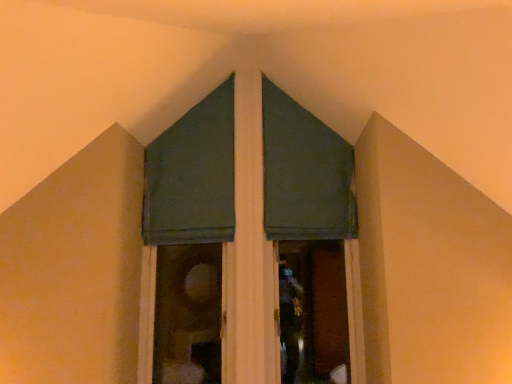
Find the location of a particular element. The width and height of the screenshot is (512, 384). green fabric curtain at center, which ranks as the 2th curtain in left-to-right order is located at coordinates pos(192,176).

Identify the location of green fabric curtain at upper center, the 3th curtain in the right-to-left sequence. The height and width of the screenshot is (384, 512). (192, 176).

From the picture: Considering the positions of objects green fabric curtain at center, which ranks as the 2th curtain in left-to-right order, and green fabric curtain at upper center, the 3th curtain in the right-to-left sequence, in the image provided, who is more to the right, green fabric curtain at center, which ranks as the 2th curtain in left-to-right order, or green fabric curtain at upper center, the 3th curtain in the right-to-left sequence,?

green fabric curtain at center, which ranks as the 2th curtain in left-to-right order.

Is green fabric curtain at upper center, marked as the 1th curtain in a left-to-right arrangement, completely or partially inside green fabric curtain at center, which ranks as the 2th curtain in left-to-right order?

Yes, green fabric curtain at upper center, marked as the 1th curtain in a left-to-right arrangement, can be found within green fabric curtain at center, which ranks as the 2th curtain in left-to-right order.

From a real-world perspective, which is physically above, green fabric curtain at center, placed as the second curtain when sorted from right to left, or green fabric curtain at upper center, the 3th curtain in the right-to-left sequence?

In real-world perspective, green fabric curtain at upper center, the 3th curtain in the right-to-left sequence, is above.

Looking at this image, which object is closer to the camera, green fabric curtain at center, which ranks as the 2th curtain in left-to-right order, or green fabric curtain at upper center, marked as the 1th curtain in a left-to-right arrangement?

Positioned in front is green fabric curtain at center, which ranks as the 2th curtain in left-to-right order.

From their relative heights in the image, would you say dark green fabric at upper center, the third curtain viewed from the left, is taller or shorter than green fabric curtain at upper center, marked as the 1th curtain in a left-to-right arrangement?

Considering their sizes, dark green fabric at upper center, the third curtain viewed from the left, has less height than green fabric curtain at upper center, marked as the 1th curtain in a left-to-right arrangement.

Which object is positioned more to the right, dark green fabric at upper center, the third curtain viewed from the left, or green fabric curtain at upper center, marked as the 1th curtain in a left-to-right arrangement?

dark green fabric at upper center, the third curtain viewed from the left, is more to the right.

Is dark green fabric at upper center, which is counted as the 1th curtain, starting from the right, not near green fabric curtain at upper center, marked as the 1th curtain in a left-to-right arrangement?

They are positioned close to each other.

Is green fabric curtain at center, which ranks as the 2th curtain in left-to-right order, not inside dark green fabric at upper center, which is counted as the 1th curtain, starting from the right?

That's correct, green fabric curtain at center, which ranks as the 2th curtain in left-to-right order, is outside of dark green fabric at upper center, which is counted as the 1th curtain, starting from the right.

Is green fabric curtain at center, placed as the second curtain when sorted from right to left, looking in the opposite direction of dark green fabric at upper center, the third curtain viewed from the left?

Absolutely, green fabric curtain at center, placed as the second curtain when sorted from right to left, is directed away from dark green fabric at upper center, the third curtain viewed from the left.

Does green fabric curtain at center, placed as the second curtain when sorted from right to left, have a lesser width compared to dark green fabric at upper center, which is counted as the 1th curtain, starting from the right?

No, green fabric curtain at center, placed as the second curtain when sorted from right to left, is not thinner than dark green fabric at upper center, which is counted as the 1th curtain, starting from the right.

From the image's perspective, which object appears higher, green fabric curtain at center, placed as the second curtain when sorted from right to left, or dark green fabric at upper center, which is counted as the 1th curtain, starting from the right?

dark green fabric at upper center, which is counted as the 1th curtain, starting from the right, from the image's perspective.

Is green fabric curtain at upper center, the 3th curtain in the right-to-left sequence, not close to green fabric curtain at center, placed as the second curtain when sorted from right to left?

Actually, green fabric curtain at upper center, the 3th curtain in the right-to-left sequence, and green fabric curtain at center, placed as the second curtain when sorted from right to left, are a little close together.

From a real-world perspective, between green fabric curtain at upper center, marked as the 1th curtain in a left-to-right arrangement, and green fabric curtain at center, which ranks as the 2th curtain in left-to-right order, who is vertically lower?

green fabric curtain at center, which ranks as the 2th curtain in left-to-right order, is physically lower.

Is green fabric curtain at upper center, marked as the 1th curtain in a left-to-right arrangement, surrounding green fabric curtain at center, placed as the second curtain when sorted from right to left?

That's incorrect, green fabric curtain at center, placed as the second curtain when sorted from right to left, is not inside green fabric curtain at upper center, marked as the 1th curtain in a left-to-right arrangement.

Which point is more distant from viewer, (205, 195) or (272, 172)?

Point (272, 172)

Could you tell me if green fabric curtain at upper center, the 3th curtain in the right-to-left sequence, is turned towards dark green fabric at upper center, which is counted as the 1th curtain, starting from the right?

No, green fabric curtain at upper center, the 3th curtain in the right-to-left sequence, does not turn towards dark green fabric at upper center, which is counted as the 1th curtain, starting from the right.

Which object is further away from the camera taking this photo, green fabric curtain at upper center, marked as the 1th curtain in a left-to-right arrangement, or dark green fabric at upper center, the third curtain viewed from the left?

dark green fabric at upper center, the third curtain viewed from the left.

Is the surface of green fabric curtain at upper center, the 3th curtain in the right-to-left sequence, in direct contact with dark green fabric at upper center, the third curtain viewed from the left?

No, green fabric curtain at upper center, the 3th curtain in the right-to-left sequence, is not next to dark green fabric at upper center, the third curtain viewed from the left.

Is point (314, 232) more distant than point (153, 200)?

No, (314, 232) is closer to viewer.

From the image's perspective, who appears lower, dark green fabric at upper center, which is counted as the 1th curtain, starting from the right, or green fabric curtain at center, placed as the second curtain when sorted from right to left?

green fabric curtain at center, placed as the second curtain when sorted from right to left, is shown below in the image.

Between dark green fabric at upper center, the third curtain viewed from the left, and green fabric curtain at center, which ranks as the 2th curtain in left-to-right order, which one has smaller width?

With smaller width is dark green fabric at upper center, the third curtain viewed from the left.

From the image's perspective, count 1st curtains upward from the green fabric curtain at center, placed as the second curtain when sorted from right to left, and point to it. Please provide its 2D coordinates.

[(304, 173)]

Where is `curtain located in front of the green fabric curtain at upper center, the 3th curtain in the right-to-left sequence`? The width and height of the screenshot is (512, 384). curtain located in front of the green fabric curtain at upper center, the 3th curtain in the right-to-left sequence is located at coordinates (192, 176).

From the green fabric curtain at upper center, marked as the 1th curtain in a left-to-right arrangement, count 2nd curtain to the right and point to it. Please provide its 2D coordinates.

[(304, 173)]

Estimate the real-world distances between objects in this image. Which object is closer to green fabric curtain at center, which ranks as the 2th curtain in left-to-right order, green fabric curtain at upper center, marked as the 1th curtain in a left-to-right arrangement, or dark green fabric at upper center, the third curtain viewed from the left?

green fabric curtain at upper center, marked as the 1th curtain in a left-to-right arrangement, is closer to green fabric curtain at center, which ranks as the 2th curtain in left-to-right order.

Which object lies further to the anchor point green fabric curtain at upper center, the 3th curtain in the right-to-left sequence, green fabric curtain at center, placed as the second curtain when sorted from right to left, or dark green fabric at upper center, the third curtain viewed from the left?

dark green fabric at upper center, the third curtain viewed from the left, lies further to green fabric curtain at upper center, the 3th curtain in the right-to-left sequence, than the other object.

In the scene shown: Considering their positions, is dark green fabric at upper center, which is counted as the 1th curtain, starting from the right, positioned closer to green fabric curtain at upper center, marked as the 1th curtain in a left-to-right arrangement, than green fabric curtain at center, placed as the second curtain when sorted from right to left?

Among the two, green fabric curtain at center, placed as the second curtain when sorted from right to left, is located nearer to green fabric curtain at upper center, marked as the 1th curtain in a left-to-right arrangement.

When comparing their distances from green fabric curtain at center, placed as the second curtain when sorted from right to left, does dark green fabric at upper center, the third curtain viewed from the left, or green fabric curtain at upper center, marked as the 1th curtain in a left-to-right arrangement, seem further?

The object further to green fabric curtain at center, placed as the second curtain when sorted from right to left, is dark green fabric at upper center, the third curtain viewed from the left.

Based on their spatial positions, is green fabric curtain at upper center, the 3th curtain in the right-to-left sequence, or green fabric curtain at center, placed as the second curtain when sorted from right to left, further from dark green fabric at upper center, which is counted as the 1th curtain, starting from the right?

The object further to dark green fabric at upper center, which is counted as the 1th curtain, starting from the right, is green fabric curtain at center, placed as the second curtain when sorted from right to left.

Considering their positions, is green fabric curtain at center, which ranks as the 2th curtain in left-to-right order, positioned further to dark green fabric at upper center, which is counted as the 1th curtain, starting from the right, than green fabric curtain at upper center, marked as the 1th curtain in a left-to-right arrangement?

The object further to dark green fabric at upper center, which is counted as the 1th curtain, starting from the right, is green fabric curtain at center, which ranks as the 2th curtain in left-to-right order.

You are a GUI agent. You are given a task and a screenshot of the screen. Output one action in this format:
    pyautogui.click(x=<x>, y=<y>)
    Task: Click on the curtain between green fabric curtain at upper center, the 3th curtain in the right-to-left sequence, and dark green fabric at upper center, the third curtain viewed from the left, in the horizontal direction
    The width and height of the screenshot is (512, 384).
    Given the screenshot: What is the action you would take?
    pyautogui.click(x=192, y=176)